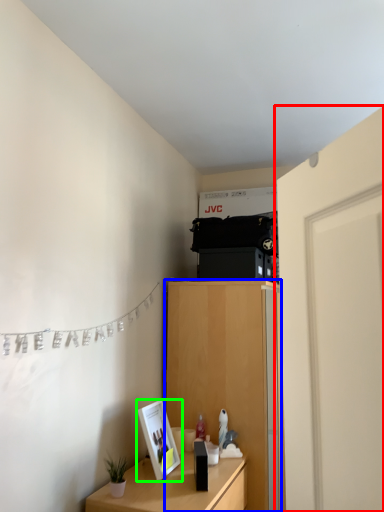
Question: Which is nearer to the door (highlighted by a red box)? cabinetry (highlighted by a blue box) or picture frame (highlighted by a green box).

Choices:
 (A) cabinetry
 (B) picture frame

Answer: (B)